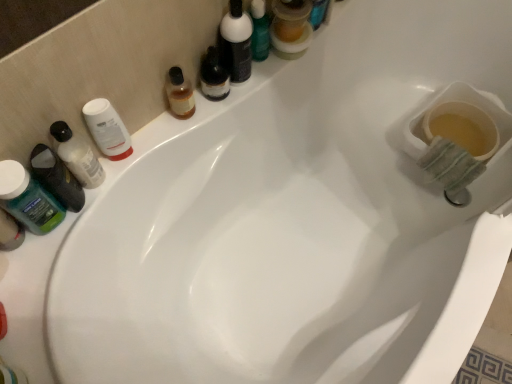
Find the location of a particular element. translucent plastic bottle at left, the first toiletry when ordered from left to right is located at coordinates (57, 178).

This screenshot has height=384, width=512. What do you see at coordinates (57, 178) in the screenshot?
I see `translucent plastic bottle at left, acting as the 2th toiletry starting from the top` at bounding box center [57, 178].

How much space does green opaque plastic mouthwash at left, which is counted as the fifth mouthwash, starting from the right, occupy vertically?

green opaque plastic mouthwash at left, which is counted as the fifth mouthwash, starting from the right, is 19.40 centimeters tall.

Describe the element at coordinates (106, 129) in the screenshot. I see `white matte jar at upper left, which appears as the 3th mouthwash when viewed from the left` at that location.

What is the approximate width of matte black bottle at upper center, which appears as the first toiletry when viewed from the top?

matte black bottle at upper center, which appears as the first toiletry when viewed from the top, is 2.38 inches wide.

I want to click on translucent amber liquid at upper center, the 2th mouthwash viewed from the right, so click(x=213, y=76).

You are a GUI agent. You are given a task and a screenshot of the screen. Output one action in this format:
    pyautogui.click(x=<x>, y=<y>)
    Task: Click on the translucent plastic bottle at left, acting as the 2th toiletry starting from the top
    
    Given the screenshot: What is the action you would take?
    pyautogui.click(x=57, y=178)

Measure the distance between translucent plastic mouthwash at left, acting as the 2th mouthwash starting from the left, and white matte jar at upper left, which appears as the 3th mouthwash when viewed from the left.

The distance of translucent plastic mouthwash at left, acting as the 2th mouthwash starting from the left, from white matte jar at upper left, which appears as the 3th mouthwash when viewed from the left, is 2.16 inches.

Is translucent plastic mouthwash at left, acting as the 2th mouthwash starting from the left, shorter than white matte jar at upper left, the 3th mouthwash positioned from the right?

In fact, translucent plastic mouthwash at left, acting as the 2th mouthwash starting from the left, may be taller than white matte jar at upper left, the 3th mouthwash positioned from the right.

How many degrees apart are the facing directions of translucent plastic mouthwash at left, the fourth mouthwash from the right, and white matte jar at upper left, which appears as the 3th mouthwash when viewed from the left?

translucent plastic mouthwash at left, the fourth mouthwash from the right, and white matte jar at upper left, which appears as the 3th mouthwash when viewed from the left, are facing 0.000375 degrees away from each other.

Is translucent plastic mouthwash at left, the fourth mouthwash from the right, aimed at white matte jar at upper left, the 3th mouthwash positioned from the right?

No, translucent plastic mouthwash at left, the fourth mouthwash from the right, is not aimed at white matte jar at upper left, the 3th mouthwash positioned from the right.

Looking at this image, is translucent plastic mouthwash at upper center, positioned as the first mouthwash in right-to-left order, facing away from matte black bottle at upper center, the 2th toiletry ordered from the bottom?

That's not correct — translucent plastic mouthwash at upper center, positioned as the first mouthwash in right-to-left order, is not looking away from matte black bottle at upper center, the 2th toiletry ordered from the bottom.

From a real-world perspective, starting from the matte black bottle at upper center, the 2th toiletry ordered from the bottom, which mouthwash is the 2nd one below it? Please provide its 2D coordinates.

[(291, 28)]

Consider the image. Who is more distant, translucent plastic mouthwash at upper center, which appears as the 5th mouthwash when viewed from the left, or matte black bottle at upper center, the 2th toiletry ordered from the bottom?

translucent plastic mouthwash at upper center, which appears as the 5th mouthwash when viewed from the left, is further away from the camera.

Find the location of a particular element. toiletry positioned vertically above the translucent plastic bottle at left, which appears as the 2th toiletry when viewed from the right (from a real-world perspective) is located at coordinates (234, 42).

From a real-world perspective, is matte black bottle at upper center, arranged as the 2th toiletry when viewed from the left, positioned under translucent plastic bottle at left, the first toiletry when ordered from left to right, based on gravity?

No, from a real-world perspective, matte black bottle at upper center, arranged as the 2th toiletry when viewed from the left, is not below translucent plastic bottle at left, the first toiletry when ordered from left to right.

Who is more distant, matte black bottle at upper center, which appears as the first toiletry when viewed from the top, or translucent plastic bottle at left, which is the 1th toiletry from bottom to top?

matte black bottle at upper center, which appears as the first toiletry when viewed from the top, is more distant.

Which is more to the right, matte black bottle at upper center, the first toiletry in the right-to-left sequence, or translucent plastic bottle at left, the first toiletry when ordered from left to right?

From the viewer's perspective, matte black bottle at upper center, the first toiletry in the right-to-left sequence, appears more on the right side.

From a real-world perspective, is translucent plastic bottle at left, acting as the 2th toiletry starting from the top, beneath green opaque plastic mouthwash at left, acting as the 1th mouthwash starting from the left?

Yes, from a real-world perspective, translucent plastic bottle at left, acting as the 2th toiletry starting from the top, is beneath green opaque plastic mouthwash at left, acting as the 1th mouthwash starting from the left.

Does translucent plastic bottle at left, the first toiletry when ordered from left to right, appear on the left side of green opaque plastic mouthwash at left, which is counted as the fifth mouthwash, starting from the right?

In fact, translucent plastic bottle at left, the first toiletry when ordered from left to right, is to the right of green opaque plastic mouthwash at left, which is counted as the fifth mouthwash, starting from the right.

Considering the relative sizes of translucent plastic bottle at left, acting as the 2th toiletry starting from the top, and green opaque plastic mouthwash at left, which is counted as the fifth mouthwash, starting from the right, in the image provided, is translucent plastic bottle at left, acting as the 2th toiletry starting from the top, shorter than green opaque plastic mouthwash at left, which is counted as the fifth mouthwash, starting from the right,?

Correct, translucent plastic bottle at left, acting as the 2th toiletry starting from the top, is not as tall as green opaque plastic mouthwash at left, which is counted as the fifth mouthwash, starting from the right.

From the image's perspective, relative to green opaque plastic mouthwash at left, acting as the 1th mouthwash starting from the left, is translucent plastic bottle at left, which appears as the 2th toiletry when viewed from the right, above or below?

Based on their image positions, translucent plastic bottle at left, which appears as the 2th toiletry when viewed from the right, is located above green opaque plastic mouthwash at left, acting as the 1th mouthwash starting from the left.

Who is bigger, white matte jar at upper left, the 3th mouthwash positioned from the right, or translucent plastic mouthwash at upper center, positioned as the first mouthwash in right-to-left order?

With larger size is translucent plastic mouthwash at upper center, positioned as the first mouthwash in right-to-left order.

Can you tell me how much white matte jar at upper left, which appears as the 3th mouthwash when viewed from the left, and translucent plastic mouthwash at upper center, positioned as the first mouthwash in right-to-left order, differ in facing direction?

They differ by 5.37 degrees in their facing directions.

Can translucent plastic mouthwash at upper center, positioned as the first mouthwash in right-to-left order, be found inside white matte jar at upper left, the 3th mouthwash positioned from the right?

No, white matte jar at upper left, the 3th mouthwash positioned from the right, does not contain translucent plastic mouthwash at upper center, positioned as the first mouthwash in right-to-left order.

From the image's perspective, which one is positioned lower, white matte jar at upper left, the 3th mouthwash positioned from the right, or translucent plastic mouthwash at upper center, positioned as the first mouthwash in right-to-left order?

From the image's view, white matte jar at upper left, the 3th mouthwash positioned from the right, is below.

Looking at this image, is white matte jar at upper left, the 3th mouthwash positioned from the right, not close to green opaque plastic mouthwash at left, which is counted as the fifth mouthwash, starting from the right?

No, there isn't a large distance between white matte jar at upper left, the 3th mouthwash positioned from the right, and green opaque plastic mouthwash at left, which is counted as the fifth mouthwash, starting from the right.

From a real-world perspective, who is located lower, white matte jar at upper left, the 3th mouthwash positioned from the right, or green opaque plastic mouthwash at left, which is counted as the fifth mouthwash, starting from the right?

white matte jar at upper left, the 3th mouthwash positioned from the right, is physically lower.

Which of these two, white matte jar at upper left, the 3th mouthwash positioned from the right, or green opaque plastic mouthwash at left, which is counted as the fifth mouthwash, starting from the right, is bigger?

green opaque plastic mouthwash at left, which is counted as the fifth mouthwash, starting from the right, is bigger.

Which is more to the left, white matte jar at upper left, which appears as the 3th mouthwash when viewed from the left, or green opaque plastic mouthwash at left, acting as the 1th mouthwash starting from the left?

green opaque plastic mouthwash at left, acting as the 1th mouthwash starting from the left, is more to the left.

Considering the relative positions of translucent plastic mouthwash at upper center, which appears as the 5th mouthwash when viewed from the left, and white matte jar at upper left, the 3th mouthwash positioned from the right, in the image provided, is translucent plastic mouthwash at upper center, which appears as the 5th mouthwash when viewed from the left, to the left of white matte jar at upper left, the 3th mouthwash positioned from the right, from the viewer's perspective?

No.

From the image's perspective, who appears lower, translucent plastic mouthwash at upper center, which appears as the 5th mouthwash when viewed from the left, or white matte jar at upper left, the 3th mouthwash positioned from the right?

white matte jar at upper left, the 3th mouthwash positioned from the right, appears lower in the image.

From a real-world perspective, which object stands above the other?

translucent plastic mouthwash at upper center, positioned as the first mouthwash in right-to-left order, is physically above.

Which object is thinner, translucent plastic mouthwash at upper center, positioned as the first mouthwash in right-to-left order, or white matte jar at upper left, which appears as the 3th mouthwash when viewed from the left?

With smaller width is white matte jar at upper left, which appears as the 3th mouthwash when viewed from the left.

The width and height of the screenshot is (512, 384). Find the location of `mouthwash that is the 1st one when counting rightward from the translucent plastic mouthwash at left, acting as the 2th mouthwash starting from the left`. mouthwash that is the 1st one when counting rightward from the translucent plastic mouthwash at left, acting as the 2th mouthwash starting from the left is located at coordinates (106, 129).

Where is `toiletry above the translucent plastic mouthwash at upper center, positioned as the first mouthwash in right-to-left order (from a real-world perspective)`? toiletry above the translucent plastic mouthwash at upper center, positioned as the first mouthwash in right-to-left order (from a real-world perspective) is located at coordinates (234, 42).

Considering their positions, is matte black bottle at upper center, the first toiletry in the right-to-left sequence, positioned further to translucent plastic bottle at left, the first toiletry when ordered from left to right, than green opaque plastic mouthwash at left, acting as the 1th mouthwash starting from the left?

matte black bottle at upper center, the first toiletry in the right-to-left sequence, is further to translucent plastic bottle at left, the first toiletry when ordered from left to right.

When comparing their distances from translucent plastic mouthwash at left, acting as the 2th mouthwash starting from the left, does white matte jar at upper left, the 3th mouthwash positioned from the right, or translucent plastic mouthwash at upper center, positioned as the first mouthwash in right-to-left order, seem further?

translucent plastic mouthwash at upper center, positioned as the first mouthwash in right-to-left order, is positioned further to the anchor translucent plastic mouthwash at left, acting as the 2th mouthwash starting from the left.

Considering their positions, is matte black bottle at upper center, arranged as the 2th toiletry when viewed from the left, positioned closer to translucent amber liquid at upper center, the 4th mouthwash when ordered from left to right, than green opaque plastic mouthwash at left, acting as the 1th mouthwash starting from the left?

matte black bottle at upper center, arranged as the 2th toiletry when viewed from the left, lies closer to translucent amber liquid at upper center, the 4th mouthwash when ordered from left to right, than the other object.

Estimate the real-world distances between objects in this image. Which object is closer to translucent plastic mouthwash at left, acting as the 2th mouthwash starting from the left, white matte jar at upper left, which appears as the 3th mouthwash when viewed from the left, or matte black bottle at upper center, which appears as the first toiletry when viewed from the top?

white matte jar at upper left, which appears as the 3th mouthwash when viewed from the left, is positioned closer to the anchor translucent plastic mouthwash at left, acting as the 2th mouthwash starting from the left.

Considering their positions, is translucent plastic bottle at left, acting as the 2th toiletry starting from the top, positioned further to green opaque plastic mouthwash at left, which is counted as the fifth mouthwash, starting from the right, than translucent amber liquid at upper center, the 2th mouthwash viewed from the right?

The object further to green opaque plastic mouthwash at left, which is counted as the fifth mouthwash, starting from the right, is translucent amber liquid at upper center, the 2th mouthwash viewed from the right.

Estimate the real-world distances between objects in this image. Which object is closer to matte black bottle at upper center, the 2th toiletry ordered from the bottom, white matte jar at upper left, the 3th mouthwash positioned from the right, or green opaque plastic mouthwash at left, acting as the 1th mouthwash starting from the left?

white matte jar at upper left, the 3th mouthwash positioned from the right, lies closer to matte black bottle at upper center, the 2th toiletry ordered from the bottom, than the other object.

Considering their positions, is translucent plastic bottle at left, which is the 1th toiletry from bottom to top, positioned further to matte black bottle at upper center, the first toiletry in the right-to-left sequence, than translucent amber liquid at upper center, the 2th mouthwash viewed from the right?

Based on the image, translucent plastic bottle at left, which is the 1th toiletry from bottom to top, appears to be further to matte black bottle at upper center, the first toiletry in the right-to-left sequence.

Consider the image. Estimate the real-world distances between objects in this image. Which object is closer to matte black bottle at upper center, the 2th toiletry ordered from the bottom, green opaque plastic mouthwash at left, acting as the 1th mouthwash starting from the left, or translucent plastic mouthwash at left, the fourth mouthwash from the right?

The object closer to matte black bottle at upper center, the 2th toiletry ordered from the bottom, is translucent plastic mouthwash at left, the fourth mouthwash from the right.

The width and height of the screenshot is (512, 384). In order to click on toiletry between translucent plastic mouthwash at left, the fourth mouthwash from the right, and green opaque plastic mouthwash at left, which is counted as the fifth mouthwash, starting from the right, from top to bottom in this screenshot , I will do `click(57, 178)`.

Identify the location of toiletry located between white matte jar at upper left, which appears as the 3th mouthwash when viewed from the left, and translucent plastic mouthwash at upper center, positioned as the first mouthwash in right-to-left order, in the left-right direction. Image resolution: width=512 pixels, height=384 pixels. (234, 42).

This screenshot has width=512, height=384. Find the location of `mouthwash between white matte jar at upper left, which appears as the 3th mouthwash when viewed from the left, and matte black bottle at upper center, which appears as the first toiletry when viewed from the top, in the horizontal direction`. mouthwash between white matte jar at upper left, which appears as the 3th mouthwash when viewed from the left, and matte black bottle at upper center, which appears as the first toiletry when viewed from the top, in the horizontal direction is located at coordinates coord(213,76).

This screenshot has height=384, width=512. In order to click on mouthwash between white matte jar at upper left, which appears as the 3th mouthwash when viewed from the left, and translucent plastic bottle at left, which appears as the 2th toiletry when viewed from the right, in the up-down direction in this screenshot , I will do `click(77, 155)`.